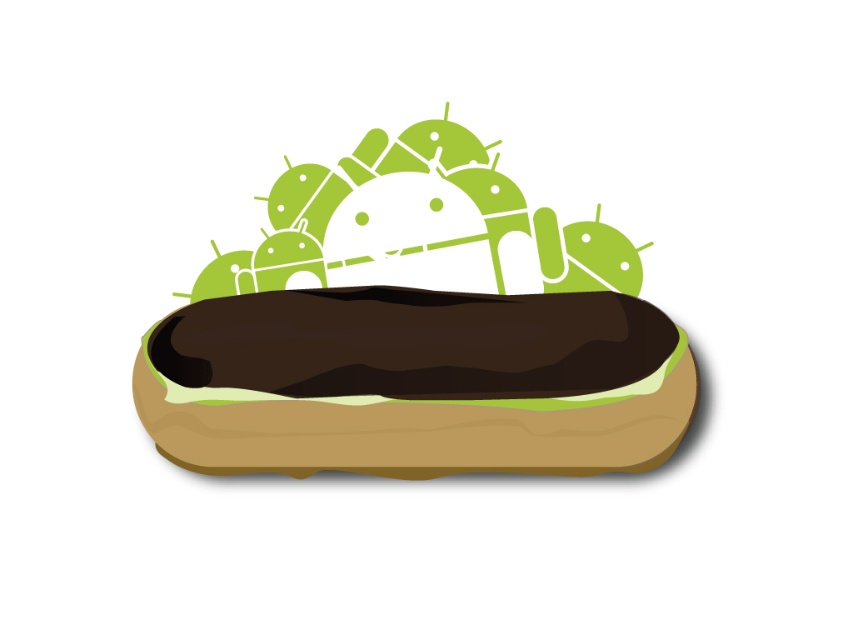
Question: Is the position of brown matte hot dog at center more distant than that of green matte androids at upper center?

Choices:
 (A) no
 (B) yes

Answer: (A)

Question: Which point is farther to the camera?

Choices:
 (A) (474, 166)
 (B) (357, 392)

Answer: (A)

Question: Can you confirm if brown matte hot dog at center is positioned below green matte androids at upper center?

Choices:
 (A) no
 (B) yes

Answer: (B)

Question: Is brown matte hot dog at center to the right of green matte androids at upper center from the viewer's perspective?

Choices:
 (A) no
 (B) yes

Answer: (A)